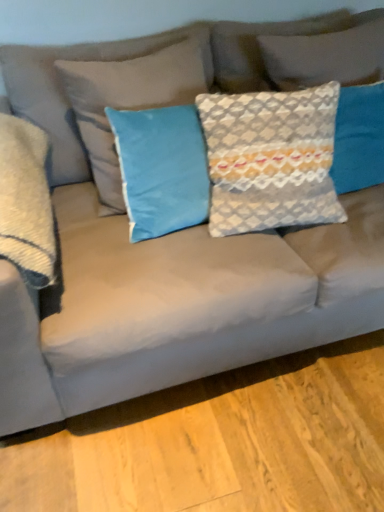
In order to click on satin gray pillow at left, acting as the 1th pillow starting from the left in this screenshot , I will do `click(26, 201)`.

What do you see at coordinates (26, 201) in the screenshot? The height and width of the screenshot is (512, 384). I see `satin gray pillow at left, the fourth pillow positioned from the right` at bounding box center [26, 201].

You are a GUI agent. You are given a task and a screenshot of the screen. Output one action in this format:
    pyautogui.click(x=<x>, y=<y>)
    Task: Click on the textured gray pillow at center, the third pillow when ordered from left to right
    This screenshot has width=384, height=512.
    Given the screenshot: What is the action you would take?
    pyautogui.click(x=270, y=159)

Is satin gray pillow at left, the fourth pillow positioned from the right, not within textured gray pillow at center, positioned as the second pillow in right-to-left order?

Yes, satin gray pillow at left, the fourth pillow positioned from the right, is located beyond the bounds of textured gray pillow at center, positioned as the second pillow in right-to-left order.

From the image's perspective, which is below, satin gray pillow at left, acting as the 1th pillow starting from the left, or textured gray pillow at center, the third pillow when ordered from left to right?

satin gray pillow at left, acting as the 1th pillow starting from the left.

Considering the positions of points (19, 149) and (289, 224), is point (19, 149) farther from camera compared to point (289, 224)?

No, it is in front of (289, 224).

Looking at this image, is satin gray pillow at left, the fourth pillow positioned from the right, taller than textured gray pillow at center, the third pillow when ordered from left to right?

In fact, satin gray pillow at left, the fourth pillow positioned from the right, may be shorter than textured gray pillow at center, the third pillow when ordered from left to right.

Is blue velvet pillow at center, marked as the 3th pillow in a right-to-left arrangement, with textured gray pillow at center, positioned as the second pillow in right-to-left order?

No, blue velvet pillow at center, marked as the 3th pillow in a right-to-left arrangement, is not with textured gray pillow at center, positioned as the second pillow in right-to-left order.

From the image's perspective, which is above, blue velvet pillow at center, placed as the 2th pillow when sorted from left to right, or textured gray pillow at center, the third pillow when ordered from left to right?

blue velvet pillow at center, placed as the 2th pillow when sorted from left to right, from the image's perspective.

Considering the sizes of blue velvet pillow at center, marked as the 3th pillow in a right-to-left arrangement, and textured gray pillow at center, positioned as the second pillow in right-to-left order, in the image, is blue velvet pillow at center, marked as the 3th pillow in a right-to-left arrangement, taller or shorter than textured gray pillow at center, positioned as the second pillow in right-to-left order,?

Clearly, blue velvet pillow at center, marked as the 3th pillow in a right-to-left arrangement, is taller compared to textured gray pillow at center, positioned as the second pillow in right-to-left order.

Based on the photo, does blue velvet pillow at center, marked as the 3th pillow in a right-to-left arrangement, have a larger size compared to textured gray pillow at center, positioned as the second pillow in right-to-left order?

Yes, blue velvet pillow at center, marked as the 3th pillow in a right-to-left arrangement, is bigger than textured gray pillow at center, positioned as the second pillow in right-to-left order.

From the image's perspective, is satin gray pillow at left, the fourth pillow positioned from the right, located beneath textured gray pillow at upper right, which is counted as the 4th pillow, starting from the left?

Indeed, from the image's perspective, satin gray pillow at left, the fourth pillow positioned from the right, is shown beneath textured gray pillow at upper right, which is counted as the 4th pillow, starting from the left.

Which is less distant, [29,282] or [327,58]?

Point [29,282].

Consider the image. Is satin gray pillow at left, the fourth pillow positioned from the right, with textured gray pillow at upper right, the first pillow when ordered from right to left?

No, satin gray pillow at left, the fourth pillow positioned from the right, is not making contact with textured gray pillow at upper right, the first pillow when ordered from right to left.

Is satin gray pillow at left, acting as the 1th pillow starting from the left, aimed at blue velvet pillow at center, placed as the 2th pillow when sorted from left to right?

No, satin gray pillow at left, acting as the 1th pillow starting from the left, is not turned towards blue velvet pillow at center, placed as the 2th pillow when sorted from left to right.

Looking at their sizes, would you say satin gray pillow at left, the fourth pillow positioned from the right, is wider or thinner than blue velvet pillow at center, placed as the 2th pillow when sorted from left to right?

Clearly, satin gray pillow at left, the fourth pillow positioned from the right, has more width compared to blue velvet pillow at center, placed as the 2th pillow when sorted from left to right.

Does satin gray pillow at left, the fourth pillow positioned from the right, have a greater height compared to blue velvet pillow at center, marked as the 3th pillow in a right-to-left arrangement?

No, satin gray pillow at left, the fourth pillow positioned from the right, is not taller than blue velvet pillow at center, marked as the 3th pillow in a right-to-left arrangement.

Who is more distant, satin gray pillow at left, acting as the 1th pillow starting from the left, or blue velvet pillow at center, marked as the 3th pillow in a right-to-left arrangement?

blue velvet pillow at center, marked as the 3th pillow in a right-to-left arrangement, is further away from the camera.

Is textured gray pillow at center, the third pillow when ordered from left to right, positioned with its back to textured gray pillow at upper right, the first pillow when ordered from right to left?

textured gray pillow at center, the third pillow when ordered from left to right, does not have its back to textured gray pillow at upper right, the first pillow when ordered from right to left.

Would you say textured gray pillow at center, positioned as the second pillow in right-to-left order, contains textured gray pillow at upper right, which is counted as the 4th pillow, starting from the left?

No, textured gray pillow at center, positioned as the second pillow in right-to-left order, does not contain textured gray pillow at upper right, which is counted as the 4th pillow, starting from the left.

Based on the photo, how different are the orientations of textured gray pillow at center, the third pillow when ordered from left to right, and textured gray pillow at upper right, which is counted as the 4th pillow, starting from the left, in degrees?

There is a 0.00213-degree angle between the facing directions of textured gray pillow at center, the third pillow when ordered from left to right, and textured gray pillow at upper right, which is counted as the 4th pillow, starting from the left.

Does textured gray pillow at center, the third pillow when ordered from left to right, have a lesser width compared to textured gray pillow at upper right, which is counted as the 4th pillow, starting from the left?

No, textured gray pillow at center, the third pillow when ordered from left to right, is not thinner than textured gray pillow at upper right, which is counted as the 4th pillow, starting from the left.

Is point (340, 216) farther from camera compared to point (14, 102)?

No, it is in front of (14, 102).

In terms of width, does textured gray pillow at center, the third pillow when ordered from left to right, look wider or thinner when compared to blue velvet pillow at center, marked as the 3th pillow in a right-to-left arrangement?

Considering their sizes, textured gray pillow at center, the third pillow when ordered from left to right, looks slimmer than blue velvet pillow at center, marked as the 3th pillow in a right-to-left arrangement.

Are textured gray pillow at center, positioned as the second pillow in right-to-left order, and blue velvet pillow at center, marked as the 3th pillow in a right-to-left arrangement, making contact?

No, textured gray pillow at center, positioned as the second pillow in right-to-left order, is not next to blue velvet pillow at center, marked as the 3th pillow in a right-to-left arrangement.

Is blue velvet pillow at center, placed as the 2th pillow when sorted from left to right, at the back of textured gray pillow at center, the third pillow when ordered from left to right?

textured gray pillow at center, the third pillow when ordered from left to right, does not have its back to blue velvet pillow at center, placed as the 2th pillow when sorted from left to right.

Which is more to the right, blue velvet pillow at center, placed as the 2th pillow when sorted from left to right, or textured gray pillow at upper right, which is counted as the 4th pillow, starting from the left?

Positioned to the right is textured gray pillow at upper right, which is counted as the 4th pillow, starting from the left.

Considering the relative sizes of blue velvet pillow at center, marked as the 3th pillow in a right-to-left arrangement, and textured gray pillow at upper right, which is counted as the 4th pillow, starting from the left, in the image provided, is blue velvet pillow at center, marked as the 3th pillow in a right-to-left arrangement, thinner than textured gray pillow at upper right, which is counted as the 4th pillow, starting from the left,?

No, blue velvet pillow at center, marked as the 3th pillow in a right-to-left arrangement, is not thinner than textured gray pillow at upper right, which is counted as the 4th pillow, starting from the left.

Considering the relative sizes of blue velvet pillow at center, marked as the 3th pillow in a right-to-left arrangement, and textured gray pillow at upper right, which is counted as the 4th pillow, starting from the left, in the image provided, is blue velvet pillow at center, marked as the 3th pillow in a right-to-left arrangement, smaller than textured gray pillow at upper right, which is counted as the 4th pillow, starting from the left,?

Incorrect, blue velvet pillow at center, marked as the 3th pillow in a right-to-left arrangement, is not smaller in size than textured gray pillow at upper right, which is counted as the 4th pillow, starting from the left.

Is textured gray pillow at upper right, which is counted as the 4th pillow, starting from the left, at the back of blue velvet pillow at center, placed as the 2th pillow when sorted from left to right?

No, blue velvet pillow at center, placed as the 2th pillow when sorted from left to right,'s orientation is not away from textured gray pillow at upper right, which is counted as the 4th pillow, starting from the left.

Where is `the 2nd pillow counting from the left of the textured gray pillow at center, the third pillow when ordered from left to right`? The image size is (384, 512). the 2nd pillow counting from the left of the textured gray pillow at center, the third pillow when ordered from left to right is located at coordinates (26, 201).

Which pillow is the 1st one when counting from the back of the textured gray pillow at center, the third pillow when ordered from left to right? Please provide its 2D coordinates.

[(65, 91)]

Estimate the real-world distances between objects in this image. Which object is closer to satin gray pillow at left, acting as the 1th pillow starting from the left, blue velvet pillow at center, marked as the 3th pillow in a right-to-left arrangement, or textured gray pillow at center, the third pillow when ordered from left to right?

blue velvet pillow at center, marked as the 3th pillow in a right-to-left arrangement, is closer to satin gray pillow at left, acting as the 1th pillow starting from the left.

Estimate the real-world distances between objects in this image. Which object is further from blue velvet pillow at center, placed as the 2th pillow when sorted from left to right, textured gray pillow at upper right, which is counted as the 4th pillow, starting from the left, or satin gray pillow at left, the fourth pillow positioned from the right?

textured gray pillow at upper right, which is counted as the 4th pillow, starting from the left, is further to blue velvet pillow at center, placed as the 2th pillow when sorted from left to right.

Looking at the image, which one is located further to satin gray pillow at left, acting as the 1th pillow starting from the left, textured gray pillow at upper right, the first pillow when ordered from right to left, or blue velvet pillow at center, marked as the 3th pillow in a right-to-left arrangement?

Among the two, textured gray pillow at upper right, the first pillow when ordered from right to left, is located further to satin gray pillow at left, acting as the 1th pillow starting from the left.

Considering their positions, is textured gray pillow at center, the third pillow when ordered from left to right, positioned closer to textured gray pillow at upper right, the first pillow when ordered from right to left, than blue velvet pillow at center, marked as the 3th pillow in a right-to-left arrangement?

textured gray pillow at center, the third pillow when ordered from left to right, lies closer to textured gray pillow at upper right, the first pillow when ordered from right to left, than the other object.

Based on their spatial positions, is blue velvet pillow at center, placed as the 2th pillow when sorted from left to right, or textured gray pillow at center, positioned as the second pillow in right-to-left order, closer to textured gray pillow at upper right, which is counted as the 4th pillow, starting from the left?

textured gray pillow at center, positioned as the second pillow in right-to-left order, lies closer to textured gray pillow at upper right, which is counted as the 4th pillow, starting from the left, than the other object.

Based on their spatial positions, is textured gray pillow at center, positioned as the second pillow in right-to-left order, or textured gray pillow at upper right, the first pillow when ordered from right to left, further from satin gray pillow at left, acting as the 1th pillow starting from the left?

textured gray pillow at upper right, the first pillow when ordered from right to left.

When comparing their distances from satin gray pillow at left, the fourth pillow positioned from the right, does textured gray pillow at center, positioned as the second pillow in right-to-left order, or blue velvet pillow at center, placed as the 2th pillow when sorted from left to right, seem closer?

Answer: blue velvet pillow at center, placed as the 2th pillow when sorted from left to right, lies closer to satin gray pillow at left, the fourth pillow positioned from the right, than the other object.

Looking at this image, which object lies further to the anchor point textured gray pillow at upper right, the first pillow when ordered from right to left, satin gray pillow at left, acting as the 1th pillow starting from the left, or textured gray pillow at center, positioned as the second pillow in right-to-left order?

satin gray pillow at left, acting as the 1th pillow starting from the left, lies further to textured gray pillow at upper right, the first pillow when ordered from right to left, than the other object.

This screenshot has height=512, width=384. Identify the location of pillow between satin gray pillow at left, the fourth pillow positioned from the right, and textured gray pillow at center, the third pillow when ordered from left to right, in the horizontal direction. (65, 91).

Locate an element on the screen. The width and height of the screenshot is (384, 512). pillow located between blue velvet pillow at center, placed as the 2th pillow when sorted from left to right, and textured gray pillow at upper right, which is counted as the 4th pillow, starting from the left, in the left-right direction is located at coordinates (270, 159).